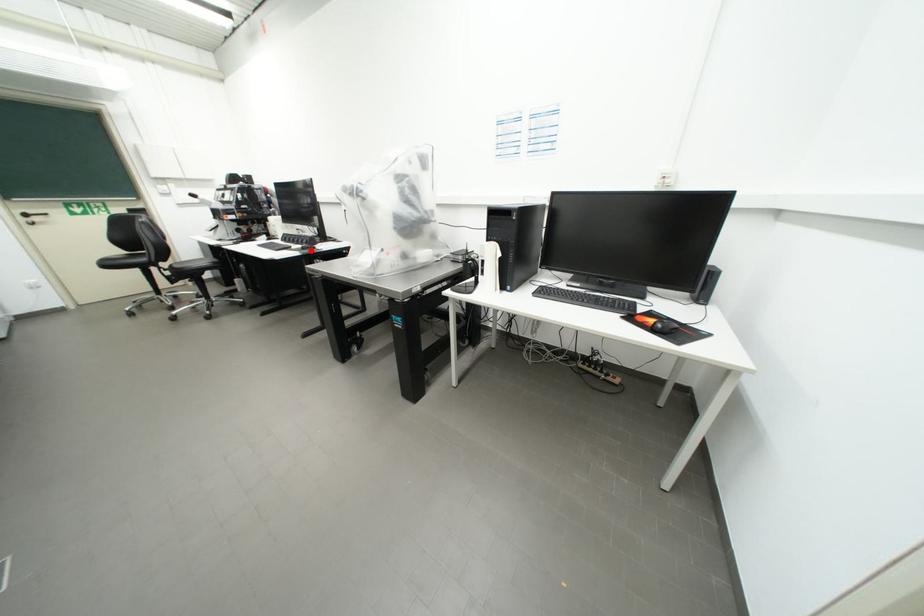
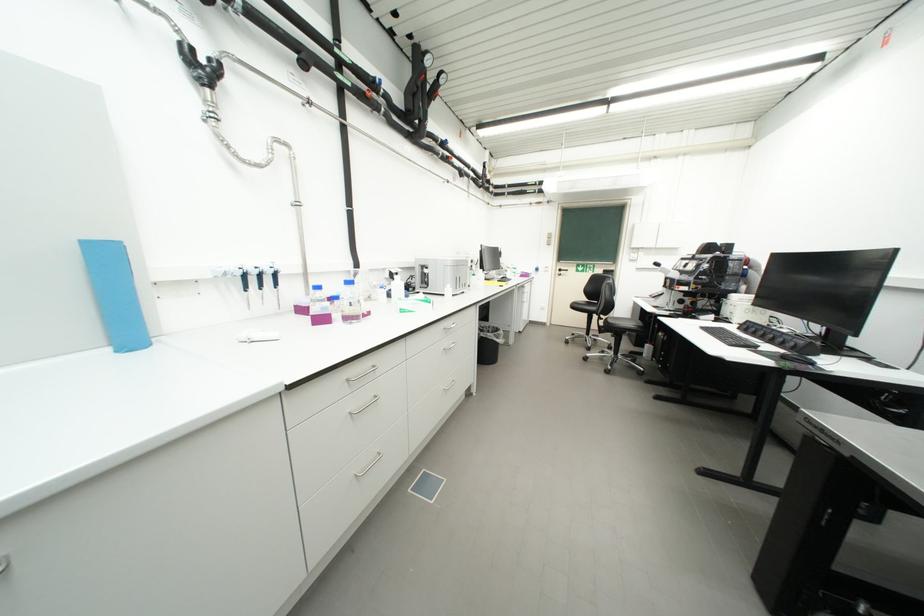
The point at the highlighted location is marked in the first image. Where is the corresponding point in the second image?

(792, 359)